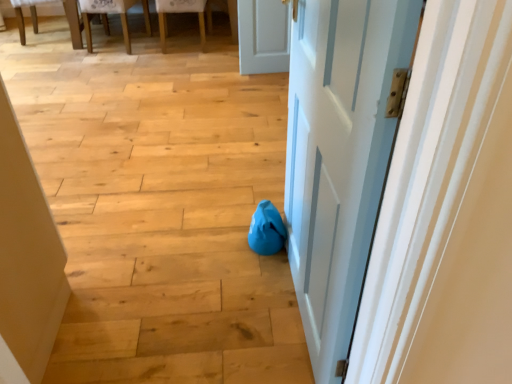
Question: Would you say wooden textured chair at upper left, which is the first chair from left to right, contains wooden chair at upper left, which ranks as the 2th chair in left-to-right order?

Choices:
 (A) no
 (B) yes

Answer: (A)

Question: Considering the relative positions of wooden textured chair at upper left, the 2th chair viewed from the right, and wooden chair at upper left, which ranks as the 2th chair in left-to-right order, in the image provided, is wooden textured chair at upper left, the 2th chair viewed from the right, to the right of wooden chair at upper left, which ranks as the 2th chair in left-to-right order, from the viewer's perspective?

Choices:
 (A) yes
 (B) no

Answer: (B)

Question: Is wooden textured chair at upper left, the 2th chair viewed from the right, further to camera compared to wooden chair at upper left, the 1th chair from the right?

Choices:
 (A) no
 (B) yes

Answer: (A)

Question: From a real-world perspective, is wooden textured chair at upper left, which is the first chair from left to right, positioned under wooden chair at upper left, the 1th chair from the right, based on gravity?

Choices:
 (A) yes
 (B) no

Answer: (B)

Question: Is wooden textured chair at upper left, which is the first chair from left to right, thinner than wooden chair at upper left, which ranks as the 2th chair in left-to-right order?

Choices:
 (A) yes
 (B) no

Answer: (B)

Question: Is wooden textured chair at upper left, the 2th chair viewed from the right, not close to wooden chair at upper left, which ranks as the 2th chair in left-to-right order?

Choices:
 (A) yes
 (B) no

Answer: (B)

Question: Considering the relative sizes of wooden textured chair at upper left, which is the first chair from left to right, and white painted wood door at center in the image provided, is wooden textured chair at upper left, which is the first chair from left to right, smaller than white painted wood door at center?

Choices:
 (A) no
 (B) yes

Answer: (A)

Question: Can you confirm if wooden textured chair at upper left, the 2th chair viewed from the right, is positioned to the right of white painted wood door at center?

Choices:
 (A) yes
 (B) no

Answer: (B)

Question: From a real-world perspective, is wooden textured chair at upper left, the 2th chair viewed from the right, positioned under white painted wood door at center based on gravity?

Choices:
 (A) yes
 (B) no

Answer: (A)

Question: Are wooden textured chair at upper left, which is the first chair from left to right, and white painted wood door at center located far from each other?

Choices:
 (A) yes
 (B) no

Answer: (A)

Question: Considering the relative sizes of wooden textured chair at upper left, the 2th chair viewed from the right, and white painted wood door at center in the image provided, is wooden textured chair at upper left, the 2th chair viewed from the right, taller than white painted wood door at center?

Choices:
 (A) yes
 (B) no

Answer: (B)

Question: Is wooden textured chair at upper left, the 2th chair viewed from the right, positioned with its back to white painted wood door at center?

Choices:
 (A) no
 (B) yes

Answer: (A)

Question: Is white painted wood door at center closer to camera compared to blue fabric bean bag at center?

Choices:
 (A) no
 (B) yes

Answer: (B)